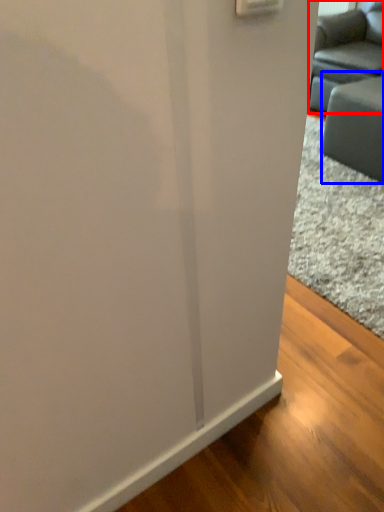
Question: Which object is further to the camera taking this photo, studio couch (highlighted by a red box) or furniture (highlighted by a blue box)?

Choices:
 (A) studio couch
 (B) furniture

Answer: (A)